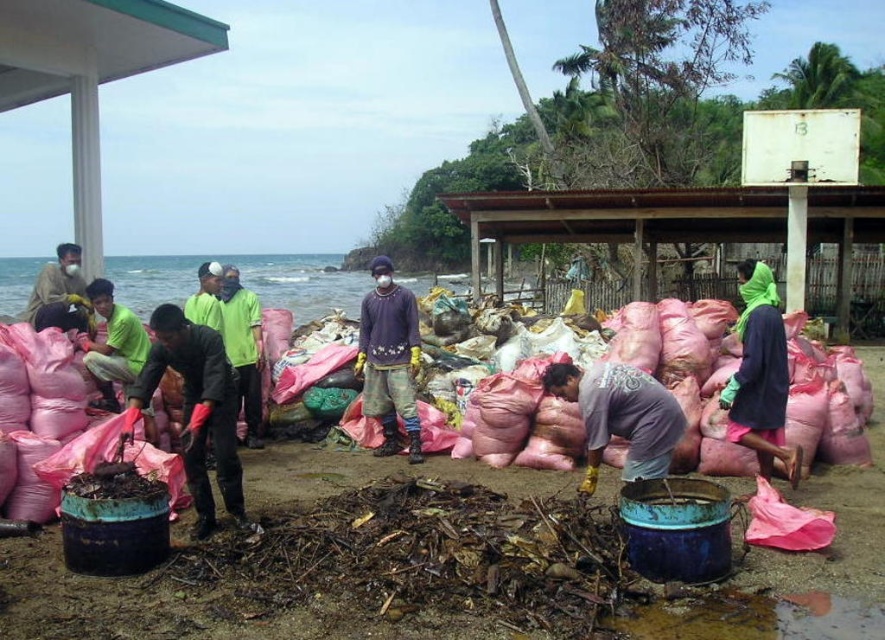
You are a photographer standing at the edge of the beach scene. You want to capture a photo that includes both the matte black shirt at center and the brown leather jacket at upper left. Given that your camera has a focal length of 50mm, which is ideal for portraits, can you estimate if both subjects will be in frame without needing to adjust your position or zoom? Assume an average human field of view is about 90 degrees horizontally.

The matte black shirt at center and brown leather jacket at upper left are 14.67 feet apart. With a 50mm lens on a full frame camera, the horizontal field of view at 90 degrees would cover approximately 34 feet. Since 14.67 feet is within this range, both subjects would likely be in frame without needing to adjust your position or zoom.

You are observing a beach cleanup scene where you see two people wearing a matte black shirt at center and a purple matte shirt at center. Which person is shorter?

The matte black shirt at center is shorter than the purple matte shirt at center, so the person wearing the matte black shirt at center is shorter.